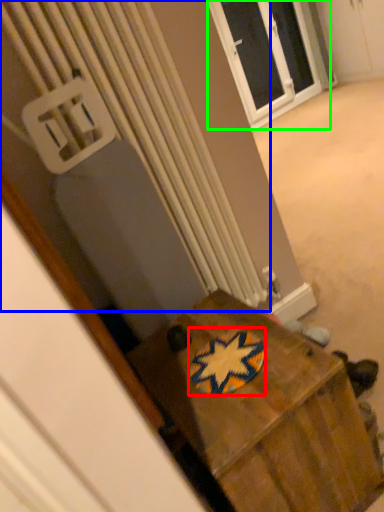
Question: Considering the real-world distances, which object is closest to design (highlighted by a red box)? radiator (highlighted by a blue box) or window (highlighted by a green box).

Choices:
 (A) radiator
 (B) window

Answer: (A)